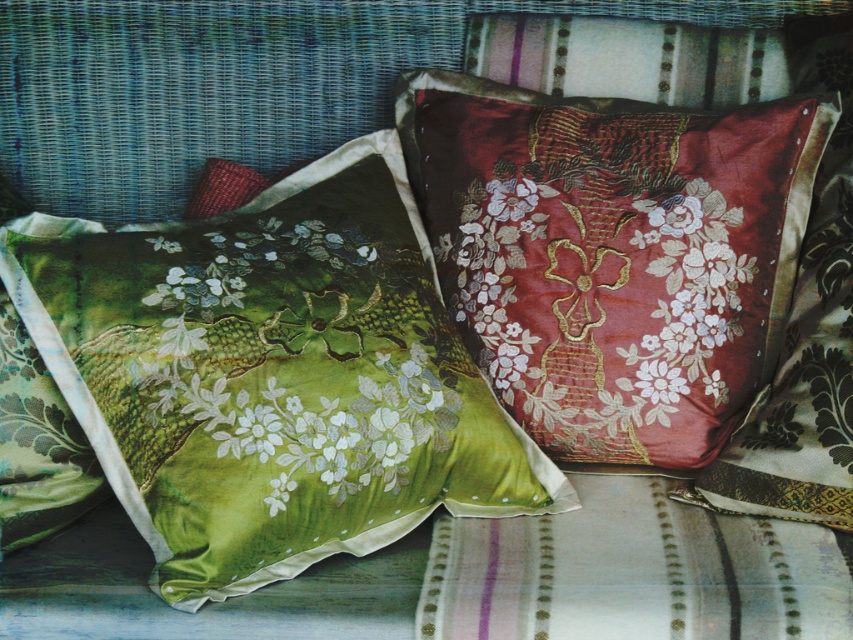
Question: In this image, where is velvet floral cushion at center located relative to silky red floral cushion at center?

Choices:
 (A) right
 (B) left

Answer: (A)

Question: Can you confirm if velvet floral cushion at center is smaller than silky red floral cushion at center?

Choices:
 (A) yes
 (B) no

Answer: (B)

Question: Which object appears farthest from the camera in this image?

Choices:
 (A) velvet floral cushion at center
 (B) silky red floral cushion at center

Answer: (A)

Question: Considering the relative positions of velvet floral cushion at center and silky red floral cushion at center in the image provided, where is velvet floral cushion at center located with respect to silky red floral cushion at center?

Choices:
 (A) right
 (B) left

Answer: (A)

Question: Which object appears closest to the camera in this image?

Choices:
 (A) velvet floral cushion at center
 (B) silky red floral cushion at center

Answer: (B)